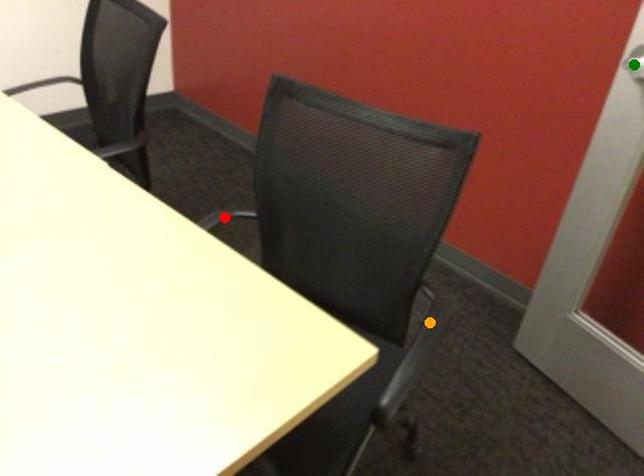
Order these from farthest to nearest:
red point, green point, orange point

1. green point
2. red point
3. orange point